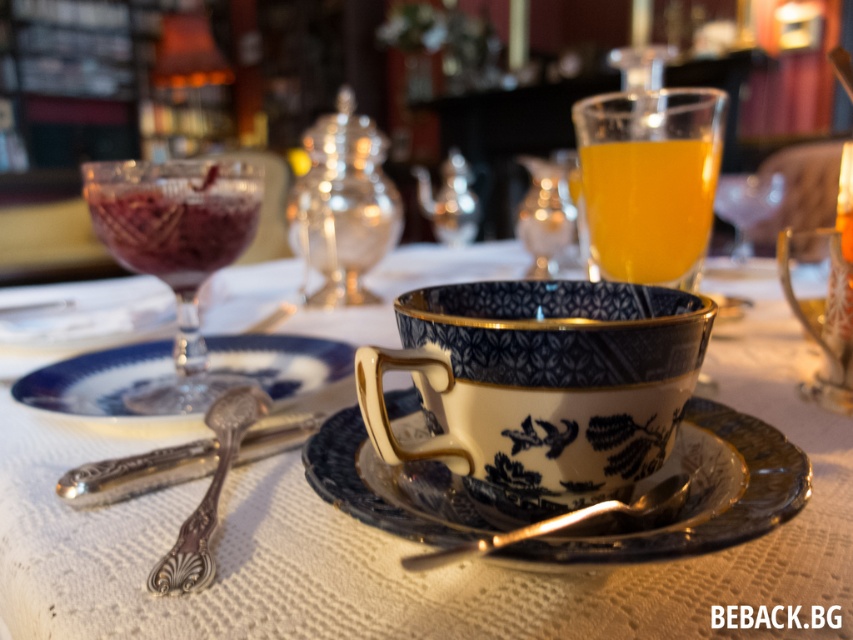
You are arranging a breakfast table and need to place the transparent glass bowl at left and the polished silver spoon at center. According to the image, which object is positioned higher up?

The transparent glass bowl at left is located above the polished silver spoon at center, so it is positioned higher up.

You are a chef who needs to place a new dessert plate on the table. The plate has a diameter of 25 centimeters. Can you fit it on the table without overlapping the blue porcelain saucer at center?

The blue porcelain saucer at center is 41.93 centimeters away from the viewer. Since the dessert plate is 25 centimeters in diameter, it can be placed on the table at a distance greater than 25 centimeters from the saucer to avoid overlapping. Therefore, it is possible to fit the dessert plate without overlapping the blue porcelain saucer at center.

You are a waiter placing a gold metallic spoon at center on the table. The blue porcelain saucer at center is already there. Where should you place the spoon relative to the saucer?

The gold metallic spoon at center should be placed behind the blue porcelain saucer at center as it is currently positioned behind it.